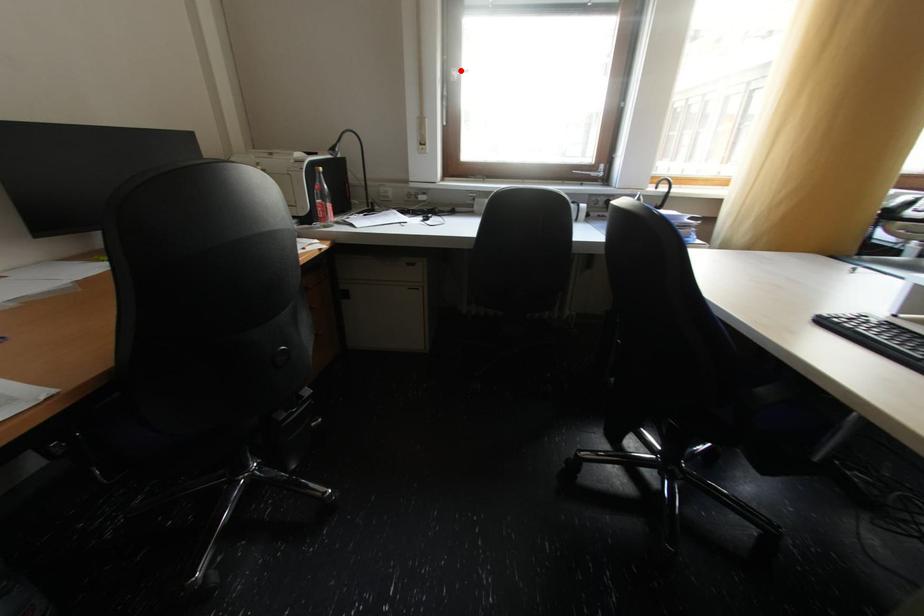
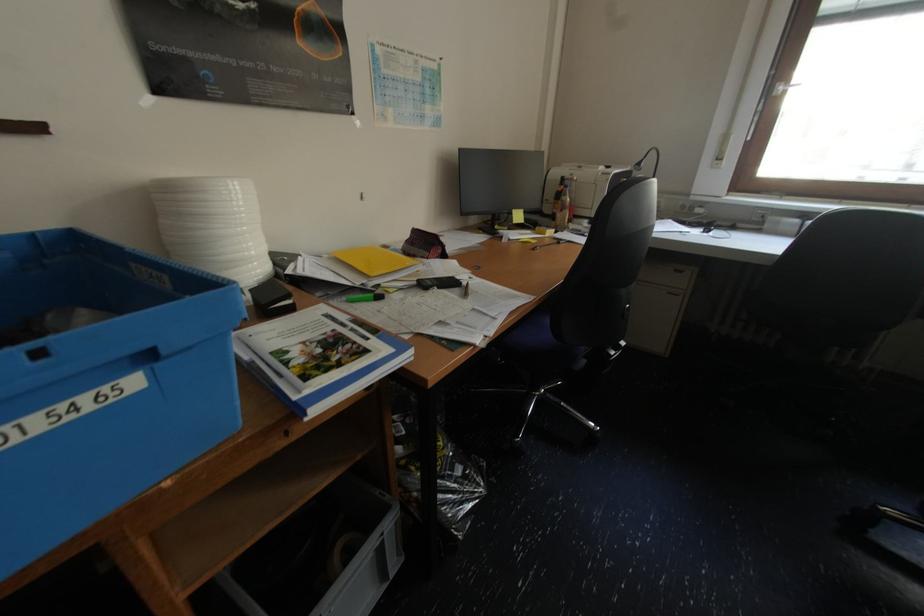
Question: I am providing you with two images of the same scene from different viewpoints. A red point is shown in image1. For the corresponding object point in image2, is it positioned nearer or farther from the camera?

Choices:
 (A) Nearer
 (B) Farther

Answer: (B)